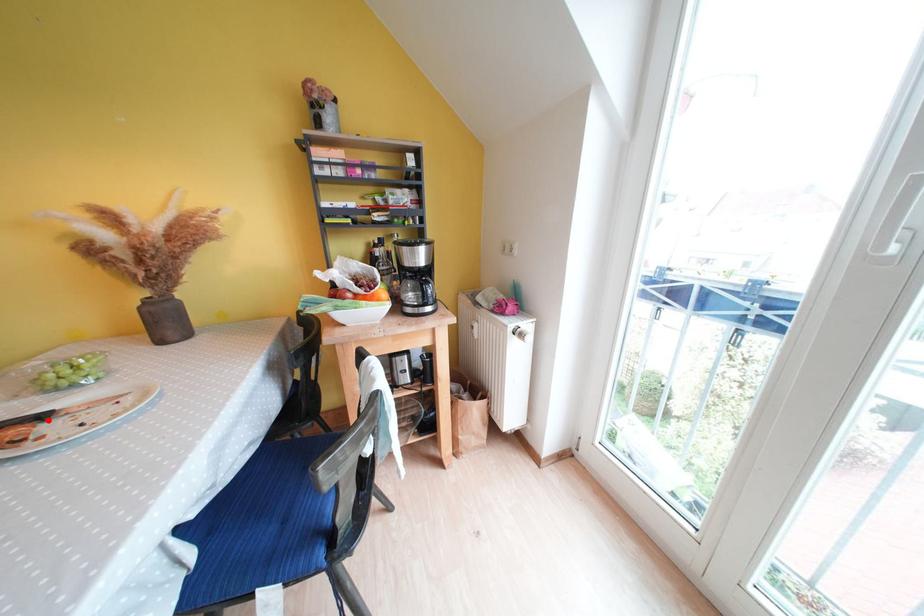
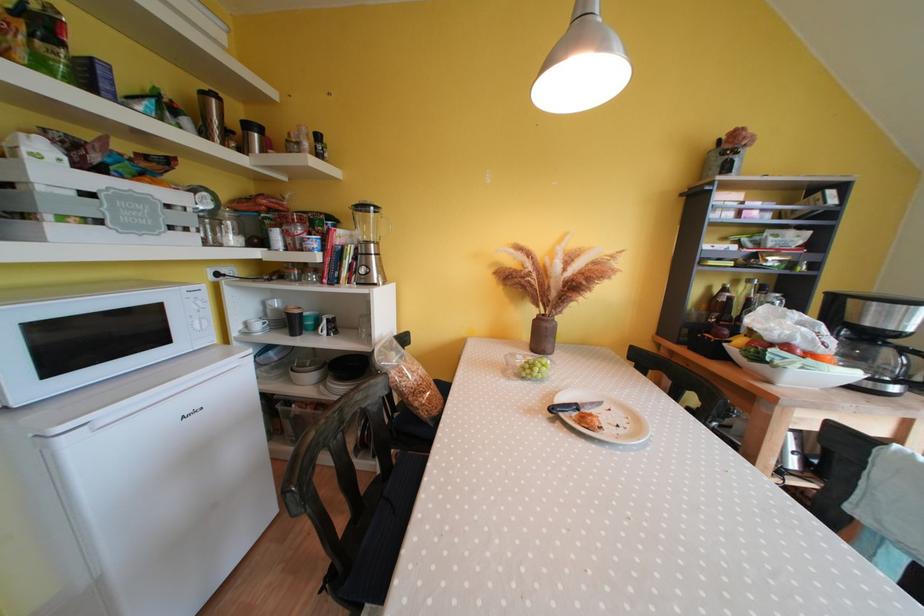
Question: I am providing you with two images of the same scene from different viewpoints. Given a red point in image1, look at the same physical point in image2. Is it:

Choices:
 (A) Closer to the viewpoint
 (B) Farther from the viewpoint

Answer: (B)